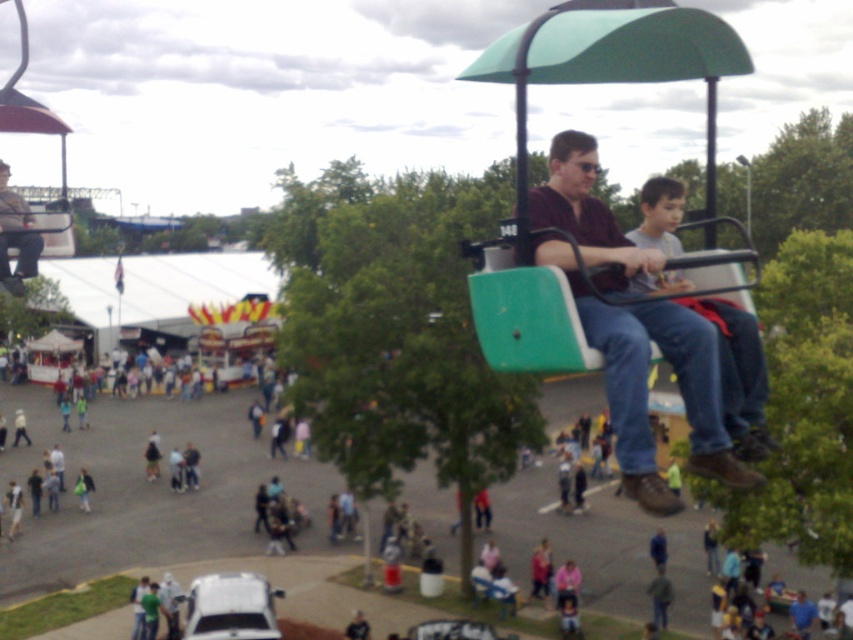
You are standing at the point labeled point (x=38, y=252) and want to walk to the point labeled point (x=625, y=481). Which direction should you move relative to your current position?

You should move forward because point (x=625, y=481) is in front of point (x=38, y=252).

You are a photographer trying to capture both the matte brown shirt at center and the matte black jacket at upper center in a single shot. Based on their sizes, which one should you focus on to ensure both are clearly visible in the frame?

The matte brown shirt at center is larger in size than the matte black jacket at upper center, so focusing on the matte brown shirt at center would help ensure both are clearly visible since it occupies more space in the frame.

You are standing at the point marked by the coordinates point [645,381] in the image. What object is located exactly at this point?

The point [645,381] indicates the location of the matte brown shirt at center.